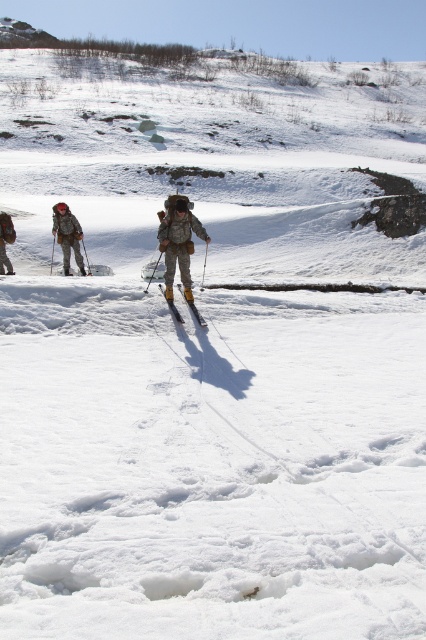
Question: Does camouflage fabric backpack at left have a smaller size compared to matte khaki pants at left?

Choices:
 (A) no
 (B) yes

Answer: (A)

Question: Is camouflage fabric jacket at center smaller than yellow metallic ski at center?

Choices:
 (A) yes
 (B) no

Answer: (B)

Question: Which object is closer to the camera taking this photo?

Choices:
 (A) camouflage fabric backpack at left
 (B) camouflage fabric jacket at center
 (C) yellow metallic ski at center

Answer: (C)

Question: Considering the real-world distances, which object is closest to the camouflage fabric backpack at left?

Choices:
 (A) camouflage fabric jacket at center
 (B) matte khaki pants at left

Answer: (B)

Question: Which of the following is the closest to the observer?

Choices:
 (A) camouflage fabric backpack at left
 (B) yellow metallic ski at center
 (C) matte khaki pants at left

Answer: (B)

Question: Is the position of matte khaki pants at left more distant than that of yellow metallic ski at center?

Choices:
 (A) yes
 (B) no

Answer: (A)